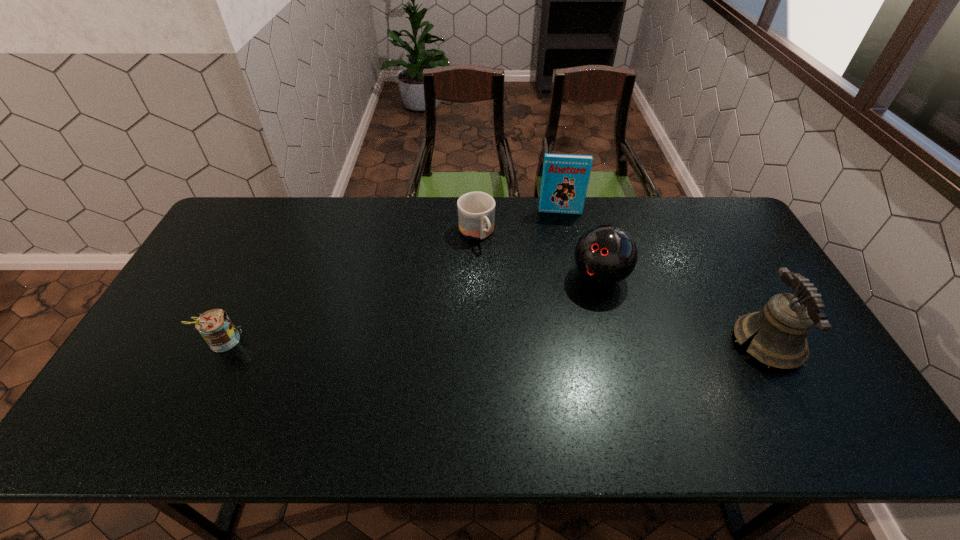
Locate an element on the screen. The width and height of the screenshot is (960, 540). object at the near edge is located at coordinates (781, 327).

The image size is (960, 540). I want to click on object present at the left edge, so click(x=215, y=326).

Identify the location of object that is at the right edge. (781, 327).

You are a GUI agent. You are given a task and a screenshot of the screen. Output one action in this format:
    pyautogui.click(x=<x>, y=<y>)
    Task: Click on the object that is at the near right corner
    Image resolution: width=960 pixels, height=540 pixels.
    Given the screenshot: What is the action you would take?
    pyautogui.click(x=781, y=327)

At what (x,y) coordinates should I click in order to perform the action: click on vacant region at the far edge of the desktop. Please return your answer as a coordinate pair (x, y). Looking at the image, I should click on (538, 234).

I want to click on vacant region at the near edge of the desktop, so click(x=550, y=393).

In the image, there is a desktop. At what (x,y) coordinates should I click in order to perform the action: click on vacant space at the left edge. Please return your answer as a coordinate pair (x, y). Looking at the image, I should click on (200, 282).

Image resolution: width=960 pixels, height=540 pixels. What are the coordinates of `vacant space at the far left corner of the desktop` in the screenshot? It's located at (272, 203).

Identify the location of vacant area at the near left corner of the desktop. (127, 387).

Locate an element on the screen. This screenshot has height=540, width=960. vacant space at the far right corner is located at coordinates (738, 234).